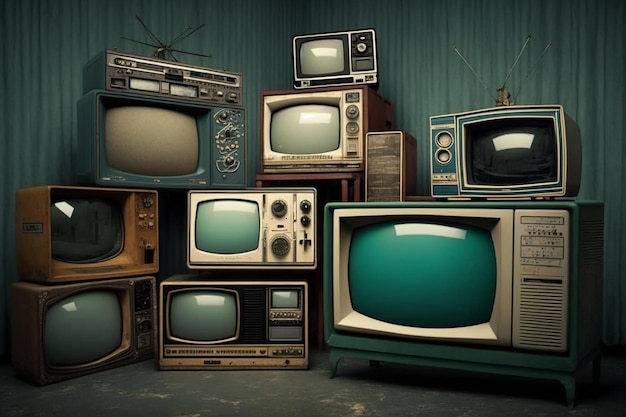
You are a GUI agent. You are given a task and a screenshot of the screen. Output one action in this format:
    pyautogui.click(x=<x>, y=<y>)
    Task: Click on the television
    The image size is (626, 417).
    Given the screenshot: What is the action you would take?
    pyautogui.click(x=81, y=326), pyautogui.click(x=88, y=255), pyautogui.click(x=135, y=157), pyautogui.click(x=317, y=52), pyautogui.click(x=305, y=126), pyautogui.click(x=237, y=215), pyautogui.click(x=222, y=322), pyautogui.click(x=399, y=298), pyautogui.click(x=500, y=146)